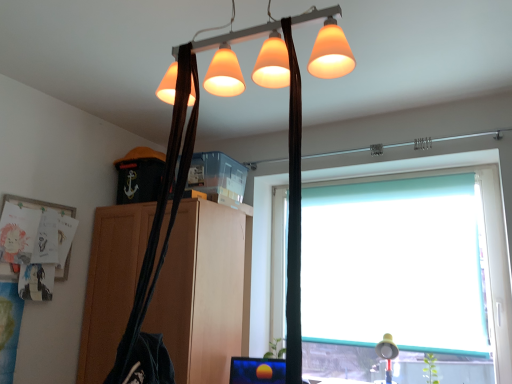
Question: Is matte orange lampshade at upper center to the left of wooden cabinet at center from the viewer's perspective?

Choices:
 (A) no
 (B) yes

Answer: (A)

Question: From a real-world perspective, is matte orange lampshade at upper center positioned under wooden cabinet at center based on gravity?

Choices:
 (A) yes
 (B) no

Answer: (B)

Question: Is matte orange lampshade at upper center smaller than wooden cabinet at center?

Choices:
 (A) yes
 (B) no

Answer: (A)

Question: Is matte orange lampshade at upper center turned away from wooden cabinet at center?

Choices:
 (A) yes
 (B) no

Answer: (B)

Question: Is matte orange lampshade at upper center next to wooden cabinet at center and touching it?

Choices:
 (A) yes
 (B) no

Answer: (B)

Question: Considering the relative positions of matte orange lampshade at upper center and wooden cabinet at center in the image provided, is matte orange lampshade at upper center to the right of wooden cabinet at center from the viewer's perspective?

Choices:
 (A) no
 (B) yes

Answer: (B)

Question: From the image's perspective, is teal roller blind at right above matte white lampshade at lower right?

Choices:
 (A) no
 (B) yes

Answer: (B)

Question: Is teal roller blind at right looking in the opposite direction of matte white lampshade at lower right?

Choices:
 (A) no
 (B) yes

Answer: (A)

Question: From a real-world perspective, is teal roller blind at right positioned under matte white lampshade at lower right based on gravity?

Choices:
 (A) yes
 (B) no

Answer: (B)

Question: Does teal roller blind at right have a lesser height compared to matte white lampshade at lower right?

Choices:
 (A) no
 (B) yes

Answer: (A)

Question: Is teal roller blind at right to the left of matte white lampshade at lower right from the viewer's perspective?

Choices:
 (A) no
 (B) yes

Answer: (A)

Question: Would you say matte white lampshade at lower right is part of teal roller blind at right's contents?

Choices:
 (A) no
 (B) yes

Answer: (A)

Question: Are wooden cabinet at center and teal roller blind at right far apart?

Choices:
 (A) no
 (B) yes

Answer: (A)